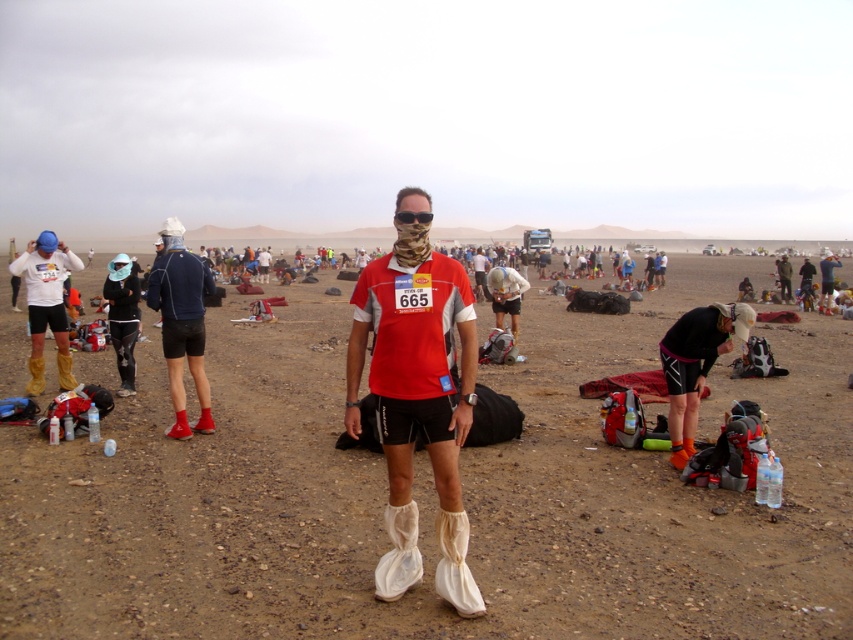
Which is behind, point (200, 316) or point (115, 285)?

Positioned behind is point (115, 285).

In the scene shown: Can you confirm if matte blue jacket at left is positioned above black matte jacket at left?

No, matte blue jacket at left is not above black matte jacket at left.

Does point (186, 324) lie behind point (105, 300)?

No, it is in front of (105, 300).

The image size is (853, 640). Find the location of `matte blue jacket at left`. matte blue jacket at left is located at coordinates (181, 323).

Can you confirm if brown sandy dirt at center is wider than matte yellow boots at left?

Yes, brown sandy dirt at center is wider than matte yellow boots at left.

Find the location of a particular element. Image resolution: width=853 pixels, height=640 pixels. brown sandy dirt at center is located at coordinates (434, 493).

I want to click on brown sandy dirt at center, so 434,493.

Is the position of matte blue jacket at left more distant than that of matte yellow boots at left?

That is False.

What do you see at coordinates (181, 323) in the screenshot? The height and width of the screenshot is (640, 853). I see `matte blue jacket at left` at bounding box center [181, 323].

Where is `matte blue jacket at left`? matte blue jacket at left is located at coordinates (181, 323).